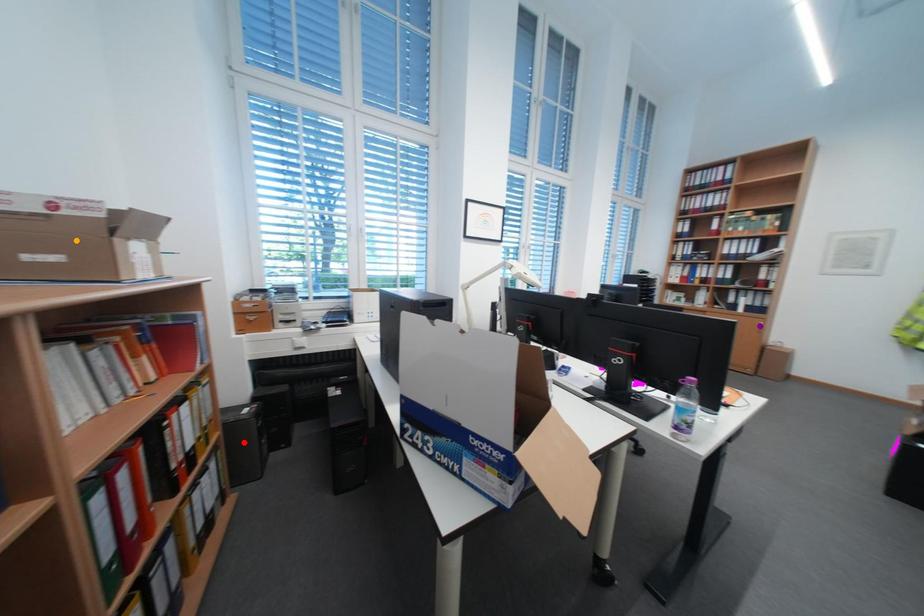
Order these from nearest to farthest:
purple point | red point | orange point

orange point, red point, purple point